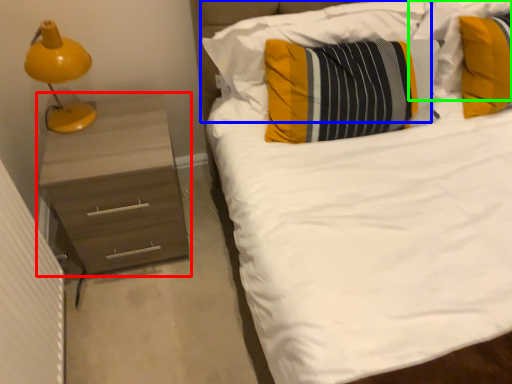
Question: Based on their relative distances, which object is nearer to chest of drawers (highlighted by a red box)? Choose from pillow (highlighted by a blue box) and pillow (highlighted by a green box).

Choices:
 (A) pillow
 (B) pillow

Answer: (A)